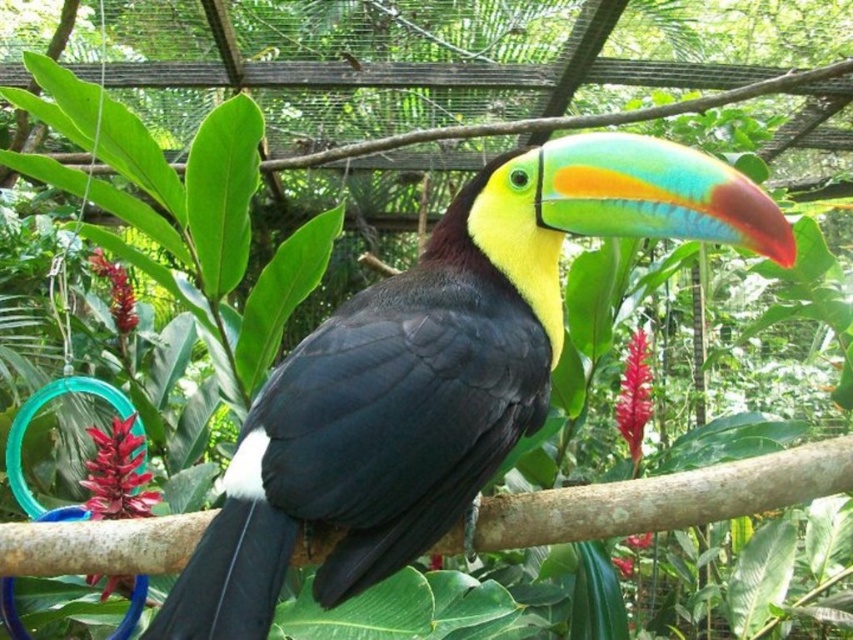
You are standing in front of a zoo enclosure and want to take a photo of the vibrant toucan perched on a branch. The zoo requires visitors to stay at least 1 meter away from the enclosure. If the point where you are standing is represented by point (677,163), will you be able to comply with the zoo rules?

The distance between point (677,163) and the viewer is 1.07 meters, so yes, you are complying with the zoo rules as you are slightly over the required distance of 1 meter.

Looking at this image, you are a zookeeper observing the enclosure. You notice the shiny black toucan at center and the brown wood at center. Which object is positioned more to the left?

The brown wood at center is positioned more to the left than the shiny black toucan at center.

You are a zookeeper standing at the entrance of the enclosure. You need to locate the shiny black toucan at center. According to the coordinates provided, where should you look to find it?

The shiny black toucan at center is located at point coordinates of [437,372].